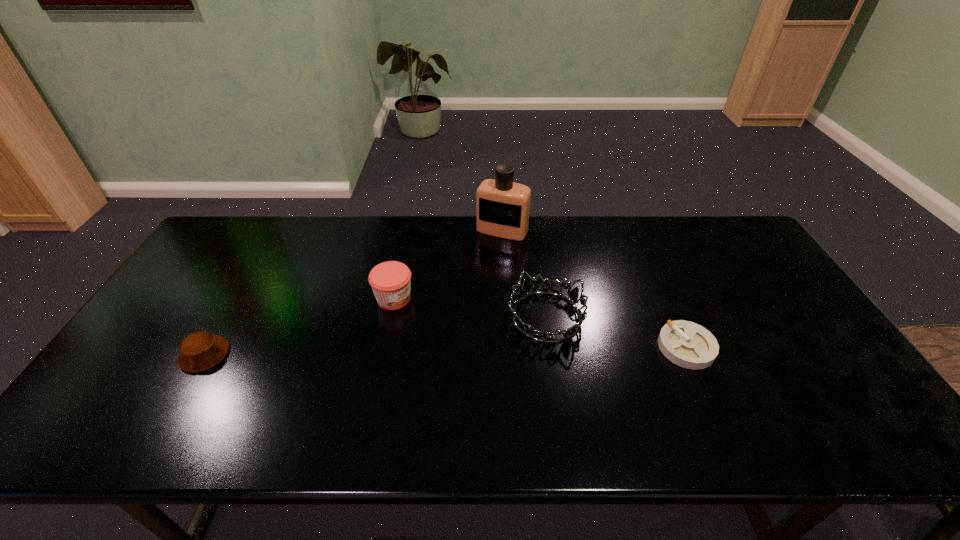
Where is `free spot on the desktop that is between the leftmost object and the shortest object and is positioned on the front label of the second object from left to right`? This screenshot has width=960, height=540. free spot on the desktop that is between the leftmost object and the shortest object and is positioned on the front label of the second object from left to right is located at coordinates (516, 350).

The width and height of the screenshot is (960, 540). What are the coordinates of `free space on the desktop that is between the muffin and the rightmost object and is positioned on the front label of the farthest object` in the screenshot? It's located at (438, 351).

Identify the location of free space on the desktop that is between the muffin and the shortest object and is positioned on the front-facing side of the tiara. This screenshot has width=960, height=540. (480, 350).